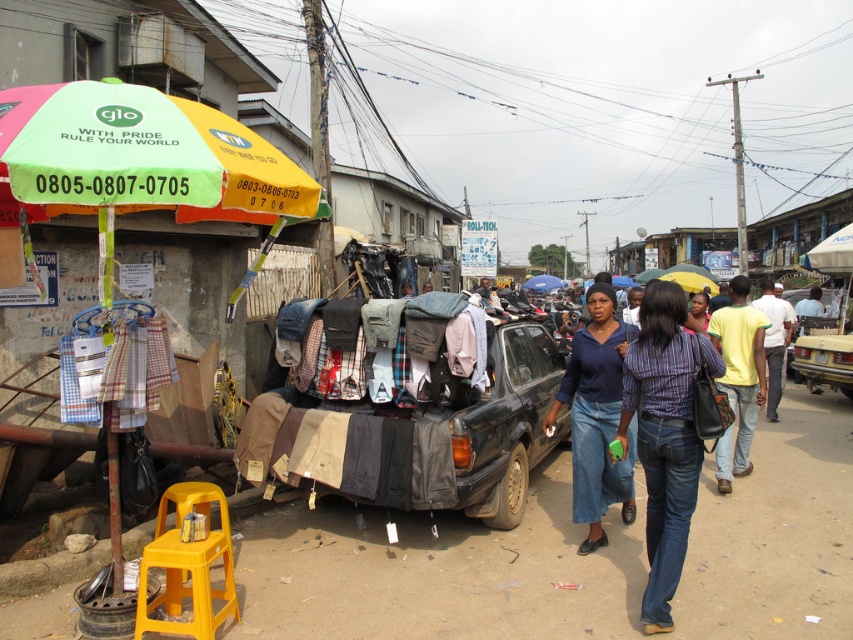
Is blue denim skirt at lower center smaller than white cotton shirt at center?

Correct, blue denim skirt at lower center occupies less space than white cotton shirt at center.

Can you confirm if blue denim skirt at lower center is bigger than white cotton shirt at center?

No, blue denim skirt at lower center is not bigger than white cotton shirt at center.

This screenshot has height=640, width=853. Find the location of `blue denim skirt at lower center`. blue denim skirt at lower center is located at coordinates (596, 417).

Where is `blue denim skirt at lower center`? The image size is (853, 640). blue denim skirt at lower center is located at coordinates (596, 417).

Which of these two, white cotton shirt at center or matte green umbrella at center, stands shorter?

With less height is matte green umbrella at center.

The width and height of the screenshot is (853, 640). Describe the element at coordinates (775, 340) in the screenshot. I see `white cotton shirt at center` at that location.

At what (x,y) coordinates should I click in order to perform the action: click on white cotton shirt at center. Please return your answer as a coordinate pair (x, y). This screenshot has height=640, width=853. Looking at the image, I should click on (775, 340).

Which is in front, point (660, 317) or point (581, 461)?

Point (660, 317) is more forward.

Is point (688, 376) positioned after point (614, 376)?

No.

Find the location of a particular element. The width and height of the screenshot is (853, 640). striped cotton shirt at center is located at coordinates (665, 435).